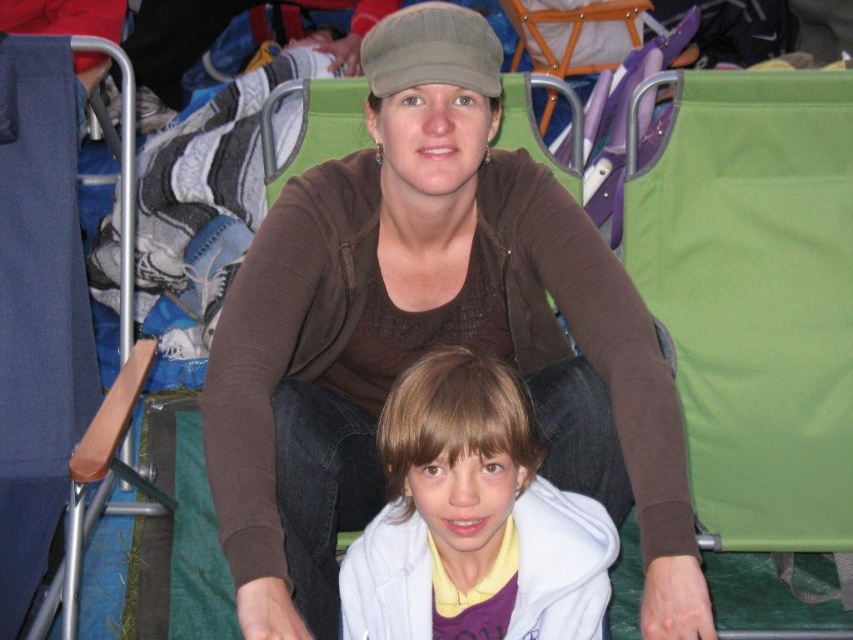
Is brown fabric sweater at center positioned at the back of white fleece jacket at center?

That is False.

Consider the image. Does brown fabric sweater at center lie in front of white fleece jacket at center?

Yes.

Which is behind, point (583, 252) or point (460, 636)?

The point (583, 252) is behind.

Identify the location of brown fabric sweater at center. This screenshot has width=853, height=640. (428, 337).